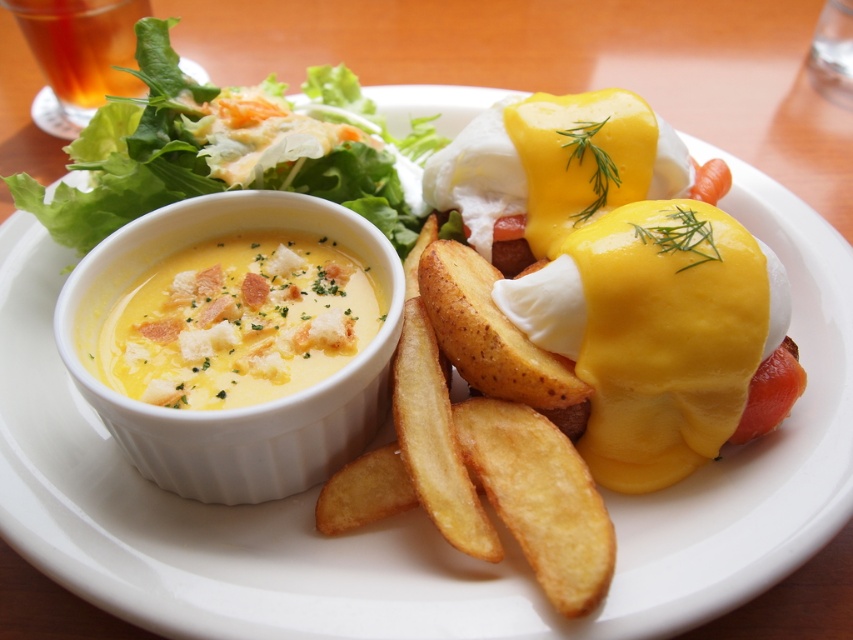
Question: Can you confirm if yellow creamy soup at center is wider than translucent amber liquid at upper left?

Choices:
 (A) yes
 (B) no

Answer: (A)

Question: Among these objects, which one is farthest from the camera?

Choices:
 (A) yellow creamy soup at center
 (B) translucent amber liquid at upper left
 (C) green leafy salad at upper left
 (D) golden crispy french fries at center

Answer: (B)

Question: Considering the relative positions of green leafy salad at upper left and translucent amber liquid at upper left in the image provided, where is green leafy salad at upper left located with respect to translucent amber liquid at upper left?

Choices:
 (A) right
 (B) left

Answer: (A)

Question: Which is farther from the golden crispy french fries at center?

Choices:
 (A) yellow creamy soup at center
 (B) green leafy salad at upper left
 (C) translucent amber liquid at upper left

Answer: (C)

Question: From the image, what is the correct spatial relationship of golden crispy french fries at center in relation to green leafy salad at upper left?

Choices:
 (A) above
 (B) below

Answer: (B)

Question: Which object is farther from the camera taking this photo?

Choices:
 (A) green leafy salad at upper left
 (B) translucent amber liquid at upper left
 (C) yellow creamy soup at center

Answer: (B)